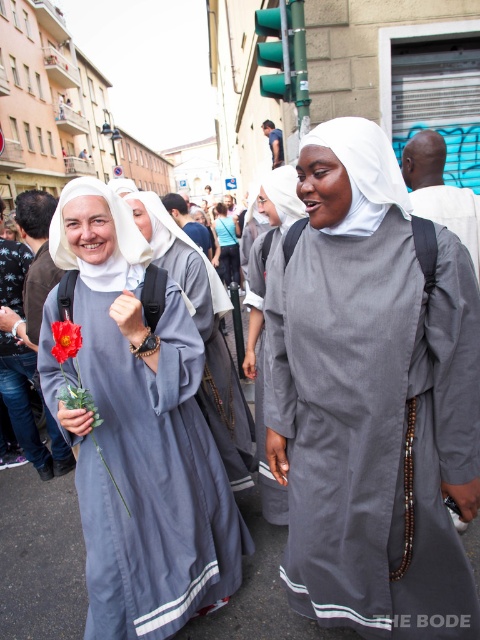
Is matte gray dress at center further to camera compared to light blue fabric dress at center?

No.

The width and height of the screenshot is (480, 640). In order to click on matte gray dress at center in this screenshot , I will do `click(151, 481)`.

Identify the location of matte gray dress at center. (151, 481).

Consider the image. Between matte gray dress at center and vivid red fabric flower at center, which one is positioned lower?

matte gray dress at center is lower down.

In the scene shown: Does matte gray dress at center come in front of vivid red fabric flower at center?

No, matte gray dress at center is further to the viewer.

Who is more forward, (108,624) or (70,333)?

Positioned in front is point (70,333).

You are a GUI agent. You are given a task and a screenshot of the screen. Output one action in this format:
    pyautogui.click(x=<x>, y=<y>)
    Task: Click on the matte gray dress at center
    The image size is (480, 640).
    Given the screenshot: What is the action you would take?
    pyautogui.click(x=151, y=481)

Which is more to the right, matte gray dress at center or matte gray robe at center?

matte gray robe at center is more to the right.

Can you confirm if matte gray dress at center is positioned below matte gray robe at center?

Correct, matte gray dress at center is located below matte gray robe at center.

Measure the distance between point (168, 365) and camera.

Point (168, 365) and camera are 2.12 meters apart from each other.

At what (x,y) coordinates should I click in order to perform the action: click on matte gray dress at center. Please return your answer as a coordinate pair (x, y). The height and width of the screenshot is (640, 480). Looking at the image, I should click on (151, 481).